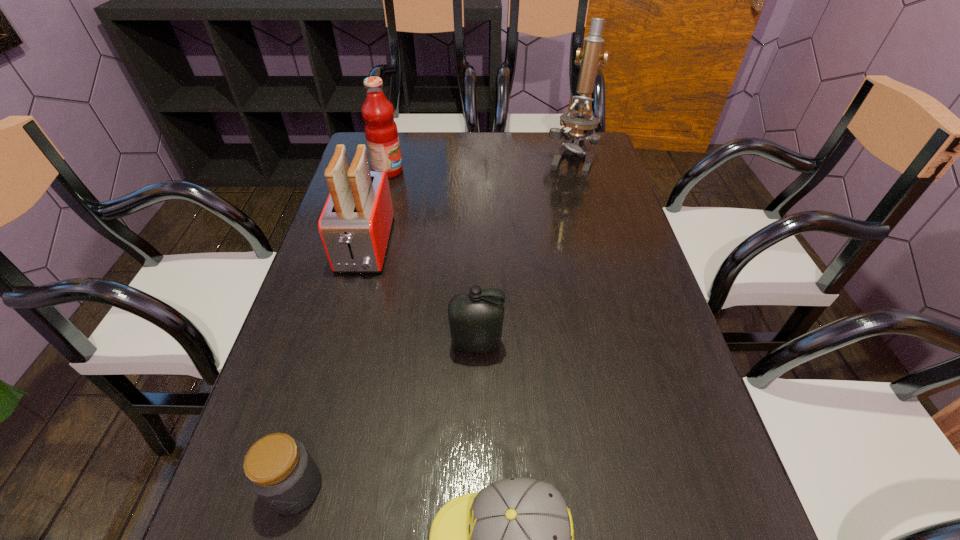
I want to click on vacant space at the left edge of the desktop, so click(303, 392).

What are the coordinates of `free space at the right edge of the desktop` in the screenshot? It's located at (564, 198).

Locate an element on the screen. free spot at the far left corner of the desktop is located at coordinates (401, 132).

The width and height of the screenshot is (960, 540). What are the coordinates of `free region at the far right corner of the desktop` in the screenshot? It's located at (561, 146).

Where is `empty location between the fruit juice and the jar`? empty location between the fruit juice and the jar is located at coordinates (342, 329).

Locate an element on the screen. empty space that is in between the fruit juice and the jar is located at coordinates (342, 329).

Where is `vacant space in between the rightmost object and the fourth farthest object`? vacant space in between the rightmost object and the fourth farthest object is located at coordinates (523, 252).

Where is `vacant area that lies between the jar and the fruit juice`? This screenshot has height=540, width=960. vacant area that lies between the jar and the fruit juice is located at coordinates (342, 329).

Image resolution: width=960 pixels, height=540 pixels. Identify the location of free space between the fourth farthest object and the toaster. (420, 295).

Find the location of a particular element. The width and height of the screenshot is (960, 540). vacant space that's between the third farthest object and the bottle is located at coordinates (420, 295).